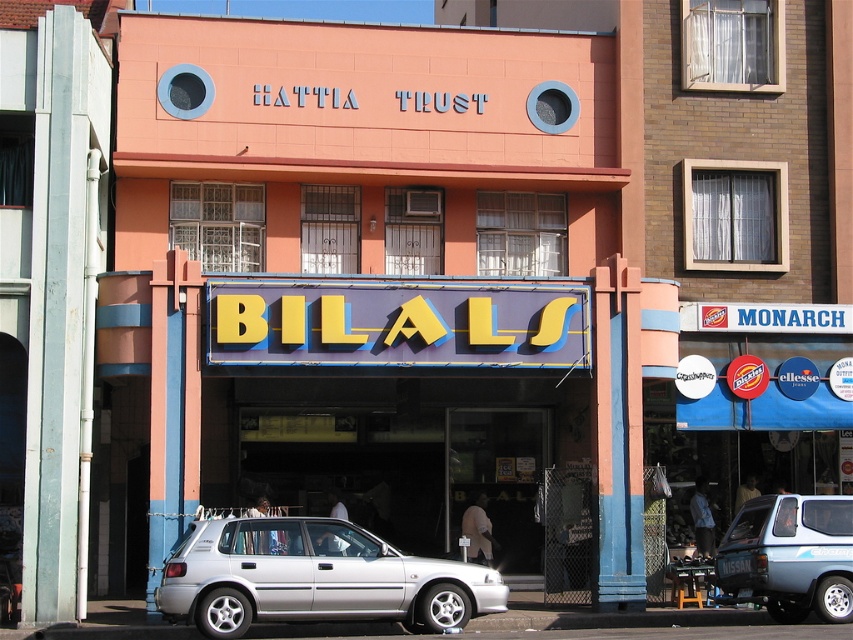
Looking at this image, is silver metallic hatchback at lower center to the left of blue metallic hatchback at lower right from the viewer's perspective?

Yes, silver metallic hatchback at lower center is to the left of blue metallic hatchback at lower right.

Can you confirm if silver metallic hatchback at lower center is thinner than blue metallic hatchback at lower right?

Incorrect, silver metallic hatchback at lower center's width is not less than blue metallic hatchback at lower right's.

Which is in front, point (212, 557) or point (833, 616)?

Positioned in front is point (212, 557).

Locate an element on the screen. This screenshot has height=640, width=853. silver metallic hatchback at lower center is located at coordinates (314, 579).